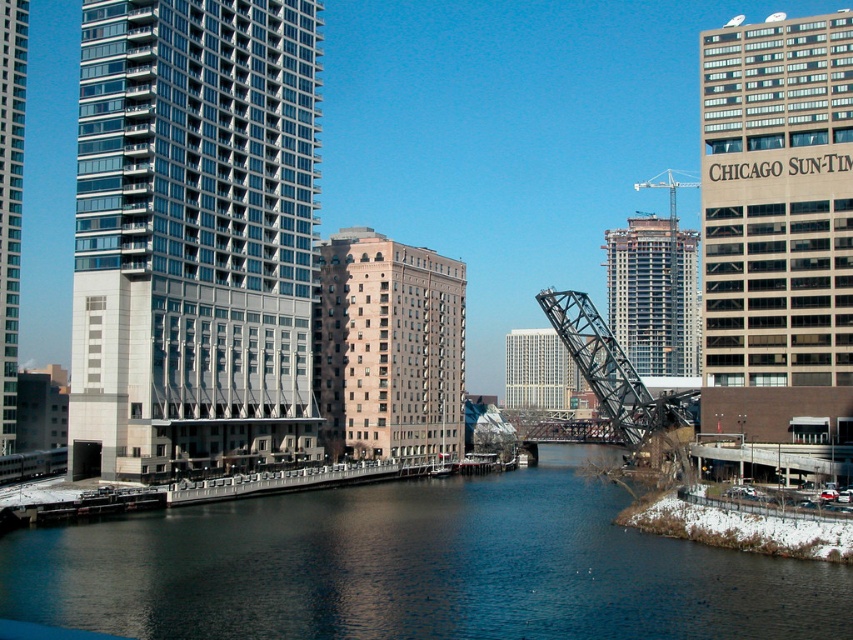
You are a city planner assessing the riverfront area. You need to determine if the glassy concrete skyscraper at left can be seen in its entirety from the dark blue water at center. Based on their widths, can you confirm this?

The glassy concrete skyscraper at left has a lesser width compared to dark blue water at center, so yes, the skyscraper can be seen in its entirety from the water since its width is narrower than the water area.

You are a photographer positioned at the riverbank. You want to capture a photo of the dark blue water at center and the glassy concrete skyscraper at left in the same frame. Based on their positions, which object should you focus on first to ensure both are in the shot?

The glassy concrete skyscraper at left is to the left of the dark blue water at center, so you should focus on the glassy concrete skyscraper at left first to include both in the frame.

You are a city planner reviewing the urban layout. You notice the brown brick building at center and the gray concrete building at center. Which one has a greater height?

The gray concrete building at center is taller than the brown brick building at center, as the brown brick building at center is not as tall as gray concrete building at center.